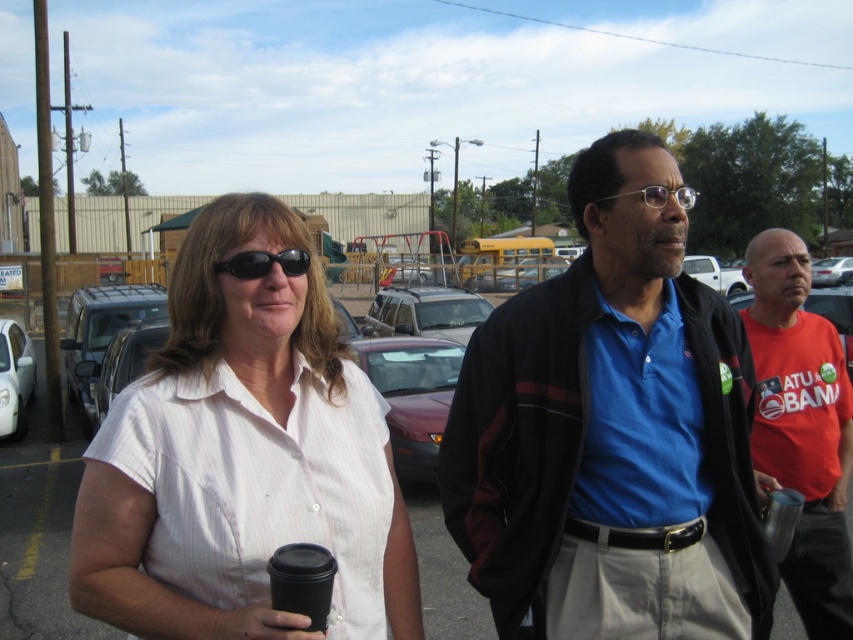
Does white matte car at left have a lesser width compared to metallic silver cup at center-right?

In fact, white matte car at left might be wider than metallic silver cup at center-right.

Is white matte car at left positioned in front of metallic silver cup at center-right?

That is False.

What do you see at coordinates (15, 378) in the screenshot? The width and height of the screenshot is (853, 640). I see `white matte car at left` at bounding box center [15, 378].

Where is `white matte car at left`? The height and width of the screenshot is (640, 853). white matte car at left is located at coordinates (15, 378).

Between metallic gold glasses at center and metallic silver sedan at center, which one has more height?

With more height is metallic silver sedan at center.

Can you confirm if metallic gold glasses at center is taller than metallic silver sedan at center?

In fact, metallic gold glasses at center may be shorter than metallic silver sedan at center.

Is point (691, 202) less distant than point (842, 260)?

Yes, it is.

At what (x,y) coordinates should I click in order to perform the action: click on metallic gold glasses at center. Please return your answer as a coordinate pair (x, y). The image size is (853, 640). Looking at the image, I should click on (659, 196).

In the scene shown: Does metallic silver cup at center-right appear over white matte truck at center?

Incorrect, metallic silver cup at center-right is not positioned above white matte truck at center.

Based on the photo, between metallic silver cup at center-right and white matte truck at center, which one is positioned higher?

white matte truck at center is higher up.

What do you see at coordinates (781, 518) in the screenshot?
I see `metallic silver cup at center-right` at bounding box center [781, 518].

Where is `metallic silver cup at center-right`? This screenshot has width=853, height=640. metallic silver cup at center-right is located at coordinates (781, 518).